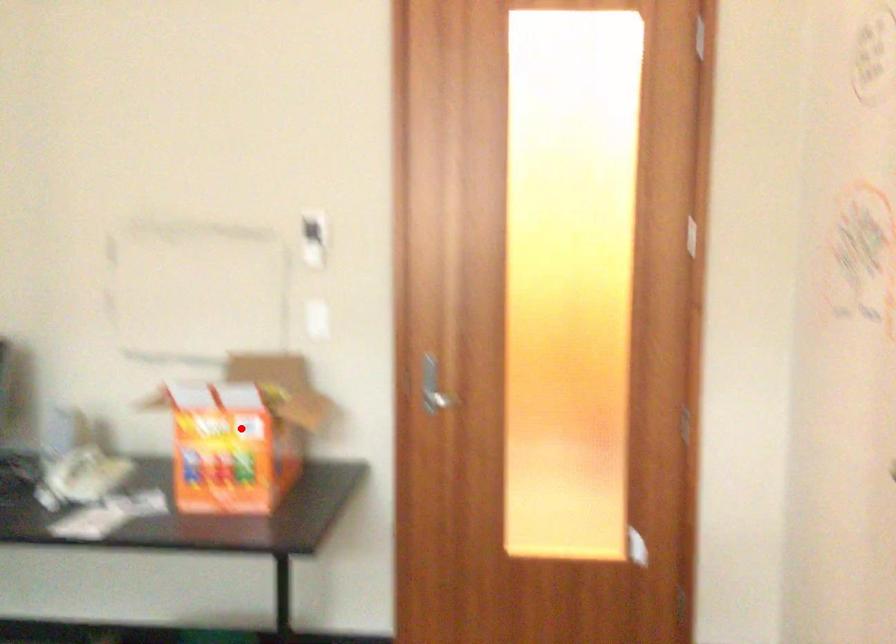
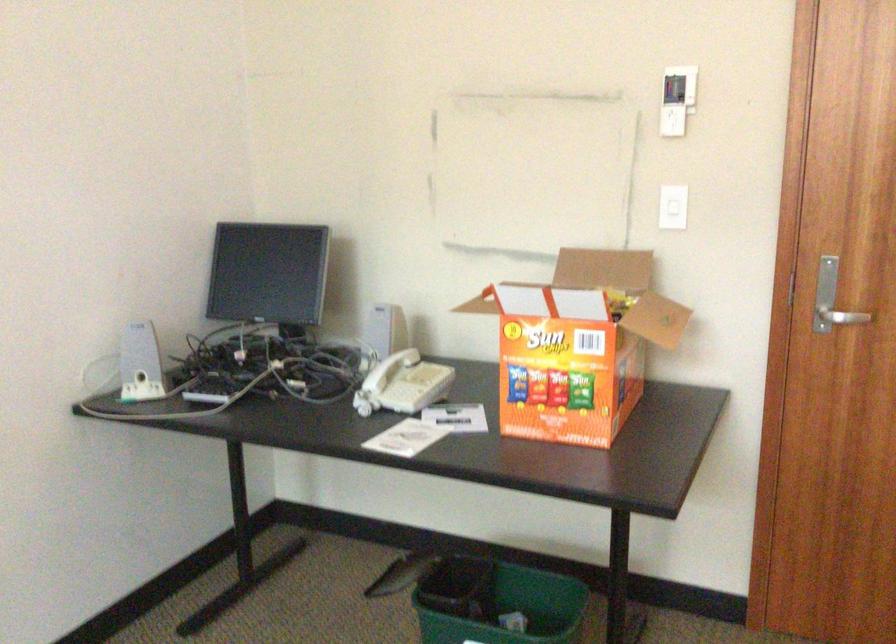
Question: I am providing you with two images of the same scene from different viewpoints. Given a red point in image1, look at the same physical point in image2. Is it:

Choices:
 (A) Closer to the viewpoint
 (B) Farther from the viewpoint

Answer: (A)